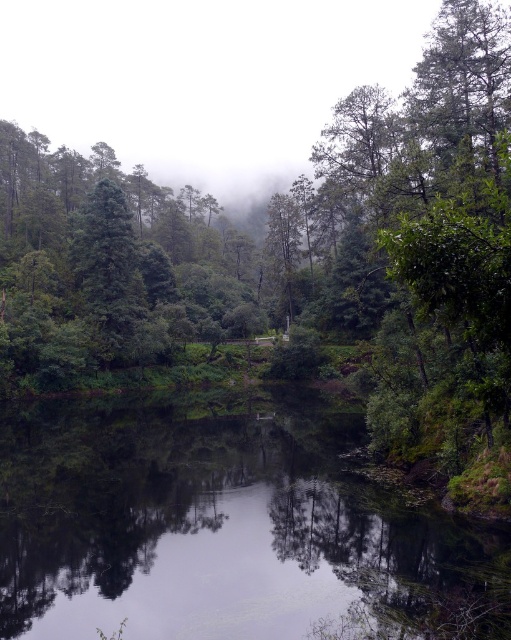
Question: Which point is farther to the camera?

Choices:
 (A) green reflective water at center
 (B) green matte tree at center

Answer: (B)

Question: Is green reflective water at center wider than green matte tree at center?

Choices:
 (A) yes
 (B) no

Answer: (A)

Question: Can you confirm if green reflective water at center is positioned to the left of green matte tree at center?

Choices:
 (A) yes
 (B) no

Answer: (B)

Question: Observing the image, what is the correct spatial positioning of green reflective water at center in reference to green matte tree at center?

Choices:
 (A) below
 (B) above

Answer: (A)